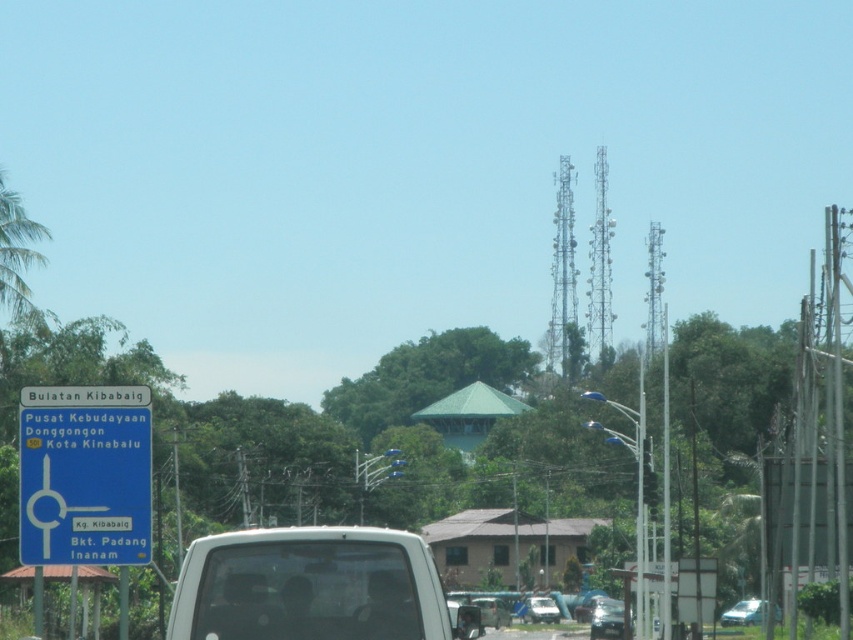
Between light blue metallic car at lower right and metallic silver car at lower right, which one is positioned lower?

metallic silver car at lower right

The height and width of the screenshot is (640, 853). Describe the element at coordinates (746, 612) in the screenshot. I see `light blue metallic car at lower right` at that location.

Who is more distant from viewer, [759,611] or [584,620]?

The point [584,620] is more distant.

You are a GUI agent. You are given a task and a screenshot of the screen. Output one action in this format:
    pyautogui.click(x=<x>, y=<y>)
    Task: Click on the light blue metallic car at lower right
    This screenshot has height=640, width=853.
    Given the screenshot: What is the action you would take?
    pyautogui.click(x=746, y=612)

Is white matte van at center taller than blue plastic sign at upper left?

Incorrect, white matte van at center's height is not larger of blue plastic sign at upper left's.

This screenshot has width=853, height=640. Describe the element at coordinates (309, 586) in the screenshot. I see `white matte van at center` at that location.

In order to click on white matte van at center in this screenshot , I will do `click(309, 586)`.

Does white glossy car at center appear over metallic silver car at center?

No.

Which is more to the right, white glossy car at center or metallic silver car at center?

white glossy car at center is more to the right.

Which is in front, point (543, 598) or point (479, 596)?

Point (479, 596)

The width and height of the screenshot is (853, 640). I want to click on white glossy car at center, so click(x=538, y=609).